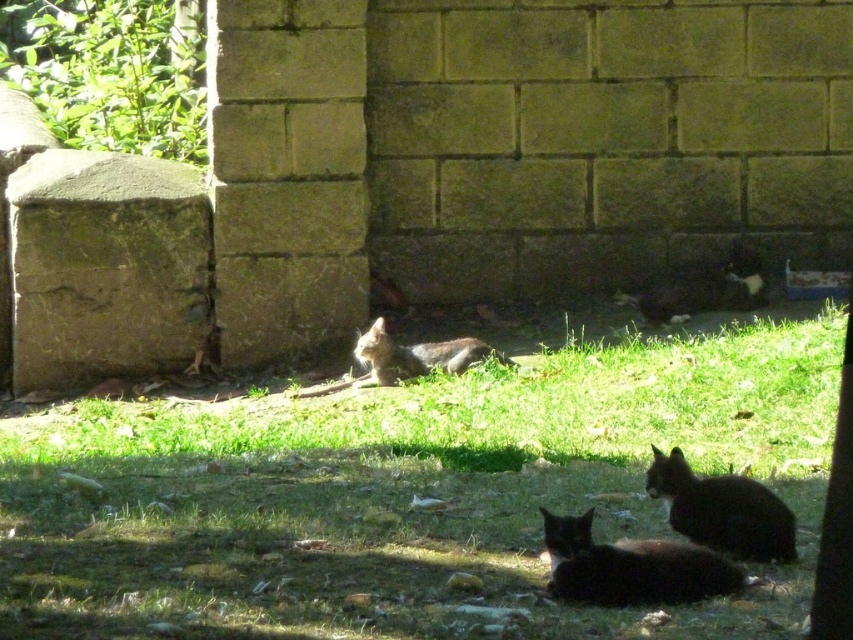
Looking at this image, you are a photographer trying to capture a photo of the black fur cat at lower right and the fuzzy gray cat at center. Since you want to include both cats in the frame, can you determine which cat is positioned lower in the image?

The black fur cat at lower right is below fuzzy gray cat at center, so the black fur cat at lower right is positioned lower in the image.